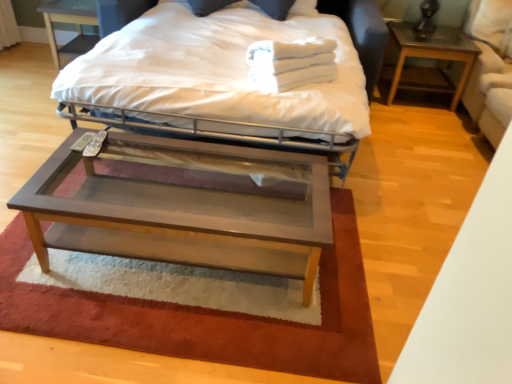
Question: Is wooden glass coffee table at center at the back of dark wood nightstand at upper left, which is counted as the 2th nightstand, starting from the right?

Choices:
 (A) no
 (B) yes

Answer: (A)

Question: Considering the relative positions of dark wood nightstand at upper left, which ranks as the 1th nightstand in left-to-right order, and wooden glass coffee table at center in the image provided, is dark wood nightstand at upper left, which ranks as the 1th nightstand in left-to-right order, to the right of wooden glass coffee table at center from the viewer's perspective?

Choices:
 (A) no
 (B) yes

Answer: (A)

Question: Is dark wood nightstand at upper left, which ranks as the 1th nightstand in left-to-right order, positioned beyond the bounds of wooden glass coffee table at center?

Choices:
 (A) no
 (B) yes

Answer: (B)

Question: Does dark wood nightstand at upper left, which is counted as the 2th nightstand, starting from the right, have a lesser height compared to wooden glass coffee table at center?

Choices:
 (A) yes
 (B) no

Answer: (B)

Question: Are dark wood nightstand at upper left, which is counted as the 2th nightstand, starting from the right, and wooden glass coffee table at center making contact?

Choices:
 (A) yes
 (B) no

Answer: (B)

Question: Is wooden glass coffee table at center completely or partially inside dark wood nightstand at upper left, which ranks as the 1th nightstand in left-to-right order?

Choices:
 (A) no
 (B) yes

Answer: (A)

Question: Is brown plush rug at center facing towards white fabric swivel chair at right?

Choices:
 (A) yes
 (B) no

Answer: (B)

Question: From the image's perspective, is brown plush rug at center over white fabric swivel chair at right?

Choices:
 (A) yes
 (B) no

Answer: (B)

Question: Is brown plush rug at center outside white fabric swivel chair at right?

Choices:
 (A) yes
 (B) no

Answer: (A)

Question: Is brown plush rug at center facing away from white fabric swivel chair at right?

Choices:
 (A) no
 (B) yes

Answer: (A)

Question: Does brown plush rug at center have a smaller size compared to white fabric swivel chair at right?

Choices:
 (A) yes
 (B) no

Answer: (A)

Question: Is brown plush rug at center behind white fabric swivel chair at right?

Choices:
 (A) yes
 (B) no

Answer: (B)

Question: Considering the relative positions of dark wood nightstand at upper left, which ranks as the 1th nightstand in left-to-right order, and white cotton towels at upper center in the image provided, is dark wood nightstand at upper left, which ranks as the 1th nightstand in left-to-right order, behind white cotton towels at upper center?

Choices:
 (A) no
 (B) yes

Answer: (B)